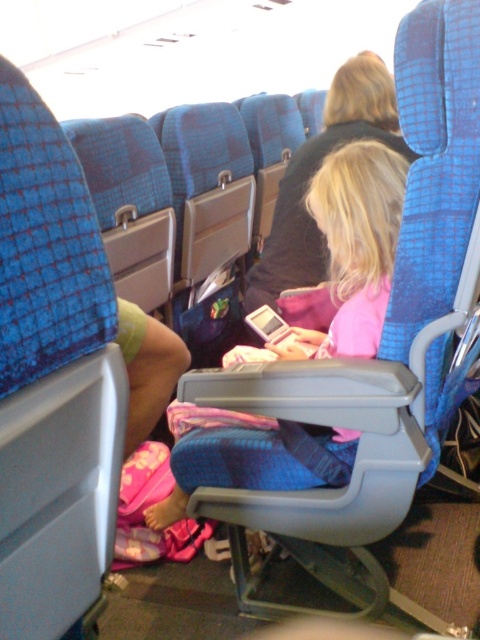
Is pink fabric at center smaller than dark blue fabric jacket at center?

No, pink fabric at center is not smaller than dark blue fabric jacket at center.

This screenshot has width=480, height=640. Describe the element at coordinates (355, 244) in the screenshot. I see `pink fabric at center` at that location.

This screenshot has width=480, height=640. What are the coordinates of `pink fabric at center` in the screenshot? It's located at (355, 244).

Where is `pink fabric at center`? pink fabric at center is located at coordinates (355, 244).